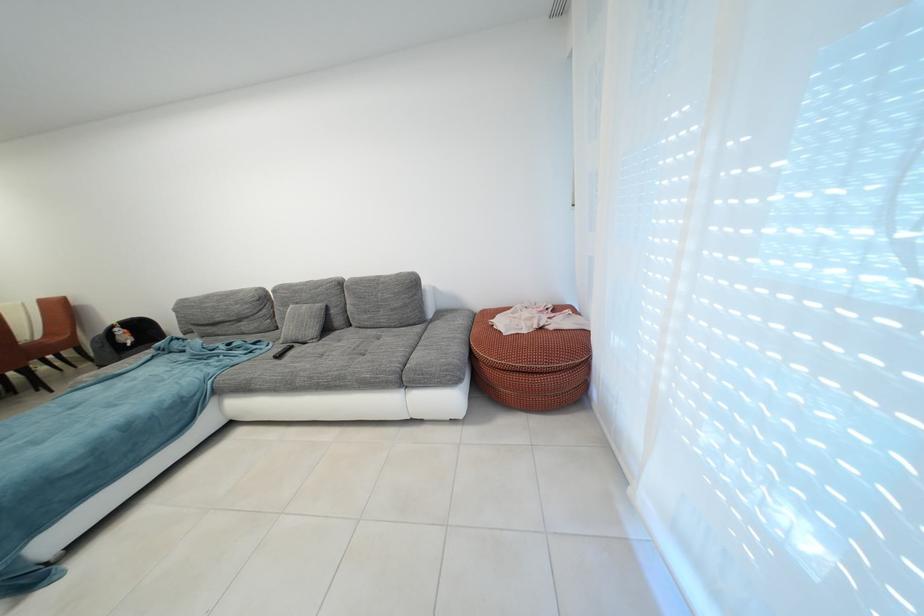
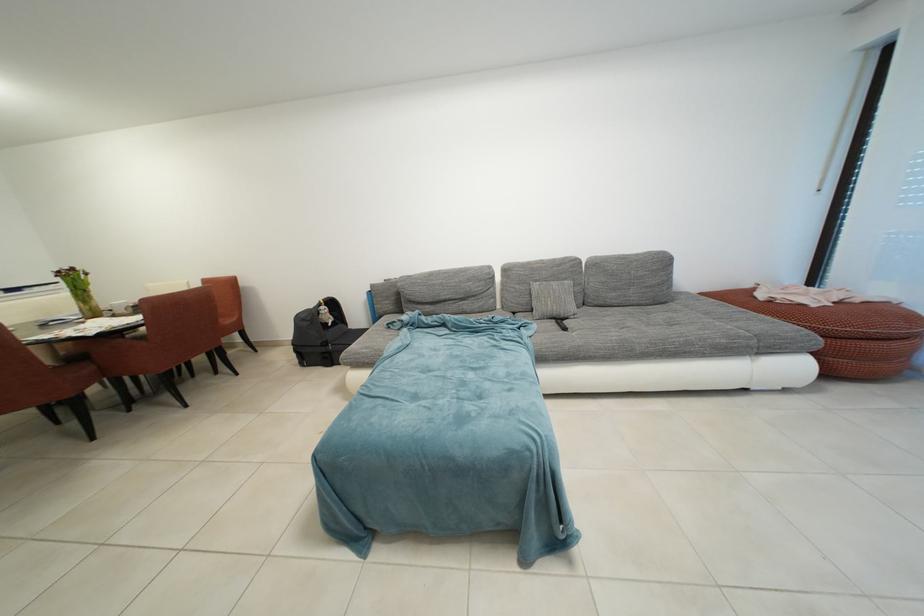
The point at (120, 331) is marked in the first image. Where is the corresponding point in the second image?

(329, 309)